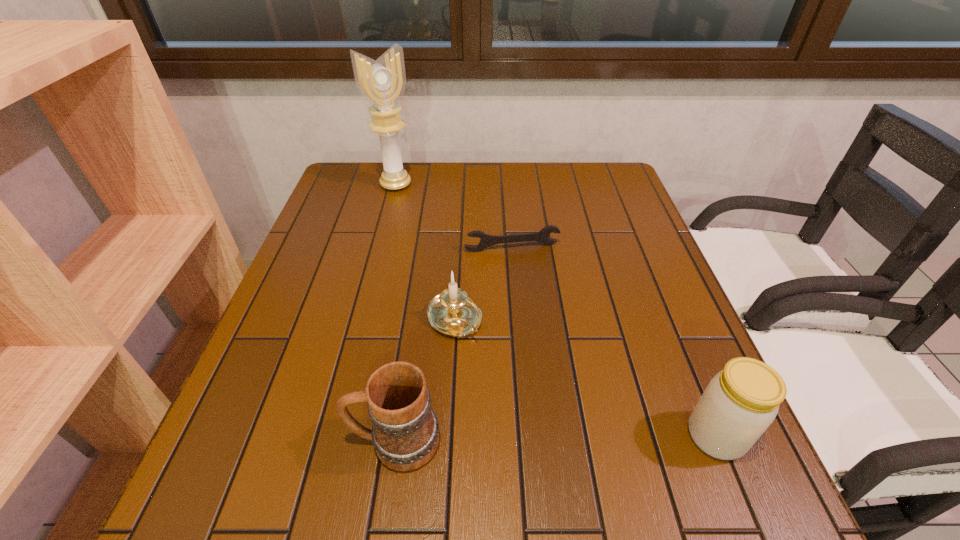
Locate an element on the screen. The height and width of the screenshot is (540, 960). free space at the left edge is located at coordinates (323, 255).

In the image, there is a desktop. Where is `free space at the right edge`? The height and width of the screenshot is (540, 960). free space at the right edge is located at coordinates (670, 298).

The image size is (960, 540). In the image, there is a desktop. Find the location of `vacant space at the far left corner`. vacant space at the far left corner is located at coordinates [337, 191].

This screenshot has width=960, height=540. What are the coordinates of `vacant space at the far right corner of the desktop` in the screenshot? It's located at [x=589, y=173].

The image size is (960, 540). What are the coordinates of `free space between the mug and the award` in the screenshot? It's located at (396, 313).

What are the coordinates of `free space between the second shortest object and the fourth nearest object` in the screenshot? It's located at (483, 284).

Identify the location of free point between the third farthest object and the award. (425, 252).

Locate an element on the screen. This screenshot has width=960, height=540. vacant space that is in between the third nearest object and the rightmost object is located at coordinates (585, 378).

The height and width of the screenshot is (540, 960). I want to click on free space between the third nearest object and the second farthest object, so [483, 284].

This screenshot has width=960, height=540. I want to click on vacant area that lies between the tallest object and the mug, so [x=396, y=313].